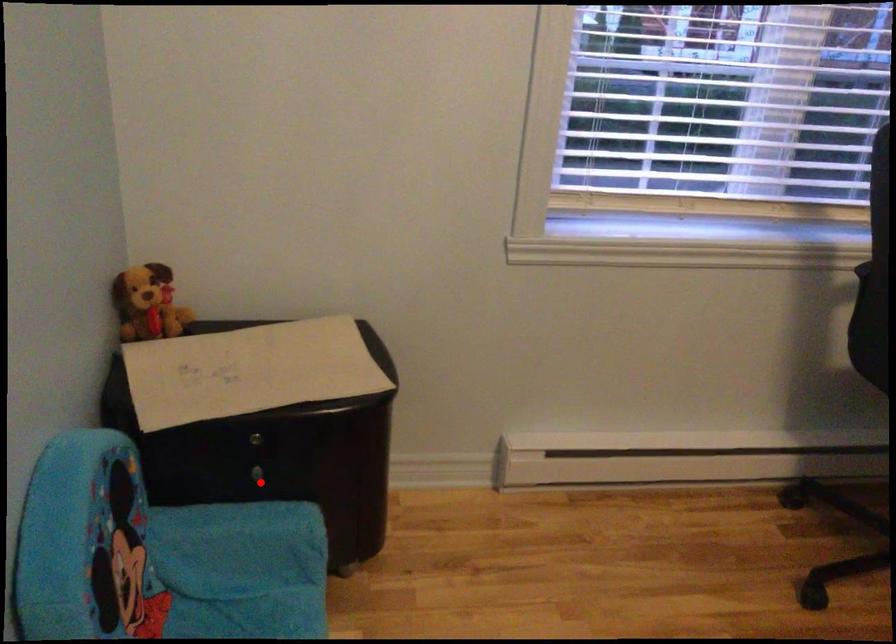
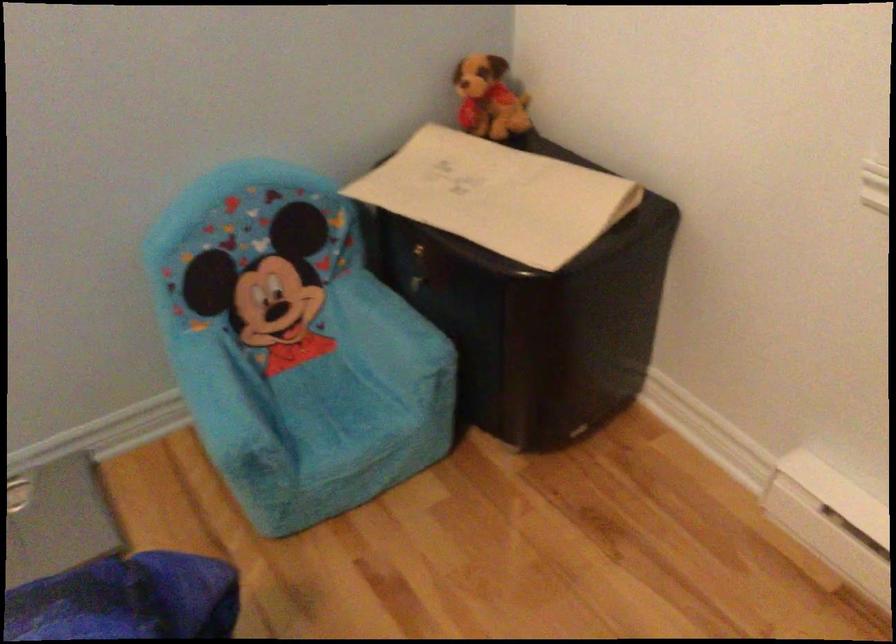
The point at the highlighted location is marked in the first image. Where is the corresponding point in the second image?

(419, 292)